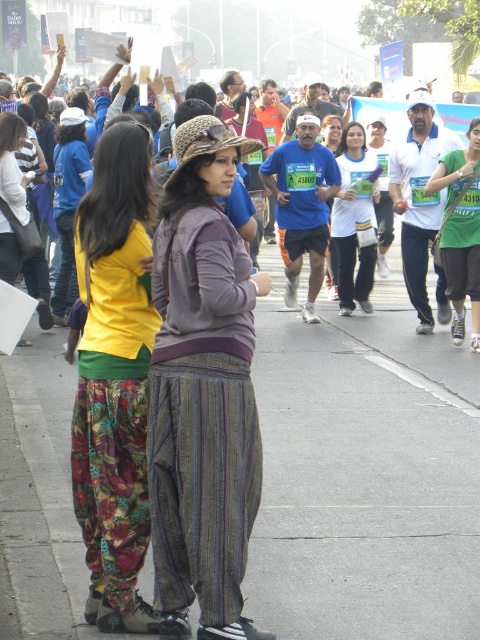
You are a photographer trying to capture a clear shot of the matte brown hat at center and the white matte shirt at center in the crowd. Based on their sizes, which one is more likely to be visible from a distance?

The matte brown hat at center is more likely to be visible from a distance because it has a greater height compared to the white matte shirt at center.